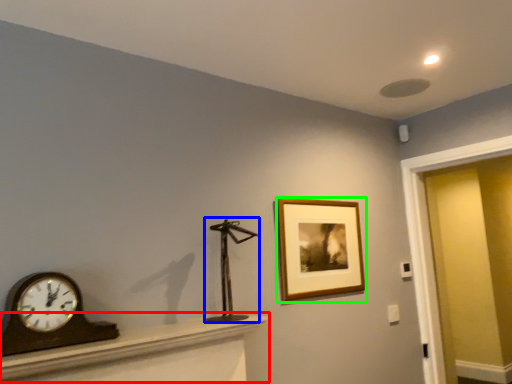
Question: Which is farther away from furniture (highlighted by a red box)? sculpture (highlighted by a blue box) or picture frame (highlighted by a green box)?

Choices:
 (A) sculpture
 (B) picture frame

Answer: (B)